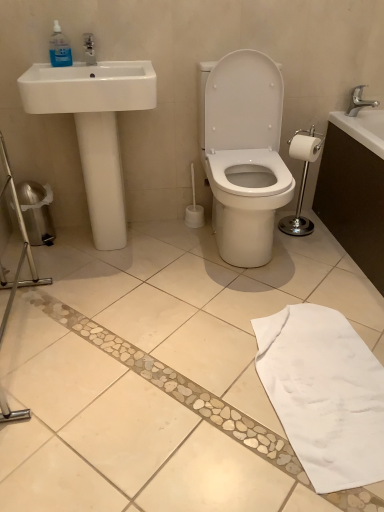
At what (x,y) coordinates should I click in order to perform the action: click on free space to the left of silver metallic faucet at upper right. Please return your answer as a coordinate pair (x, y). The image size is (384, 512). Looking at the image, I should click on (336, 116).